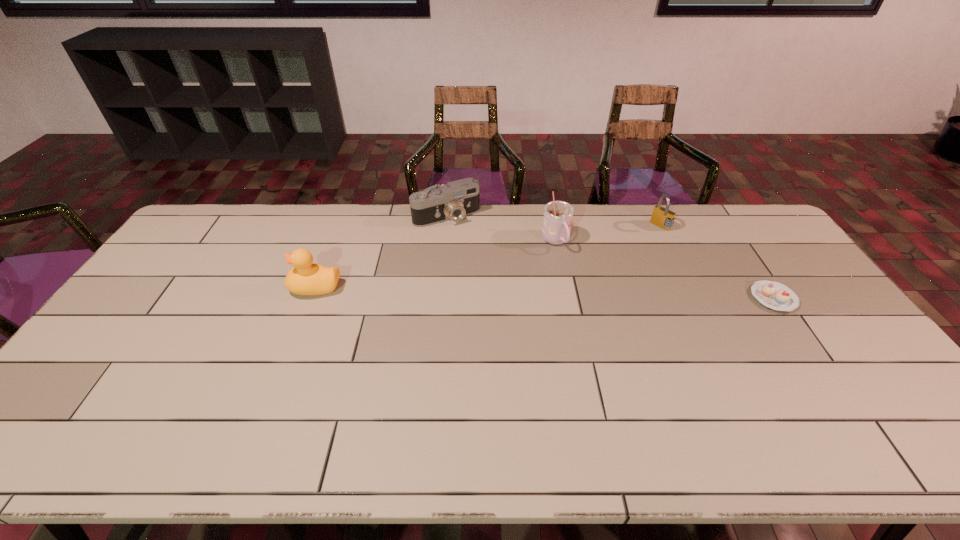
I want to click on duck, so click(306, 278).

Where is `cupcake`? cupcake is located at coordinates (774, 295).

What are the coordinates of `the shortest object` in the screenshot? It's located at (774, 295).

Identify the location of the fourth object from left to right. (662, 217).

Where is `cup`? cup is located at coordinates (558, 215).

Locate an element on the screen. The height and width of the screenshot is (540, 960). the second object from left to right is located at coordinates [455, 200].

Locate an element on the screen. free space located on the face of the leftmost object is located at coordinates pyautogui.click(x=260, y=287).

Locate an element on the screen. The image size is (960, 540). vacant region located on the face of the leftmost object is located at coordinates (271, 287).

Identify the location of vacant area situated 0.180m on the face of the leftmost object. The width and height of the screenshot is (960, 540). (231, 287).

The width and height of the screenshot is (960, 540). I want to click on vacant space located on the back of the shortest object, so click(732, 236).